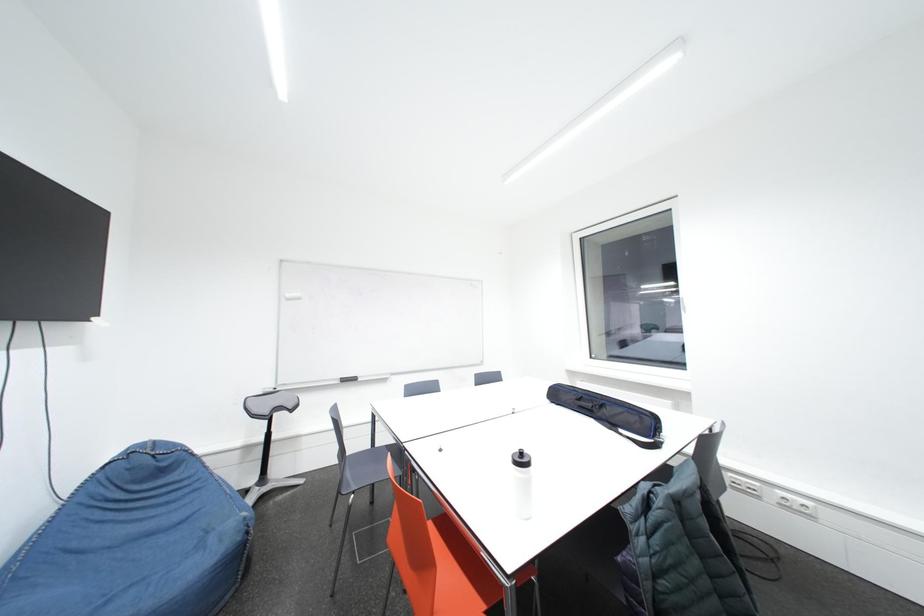
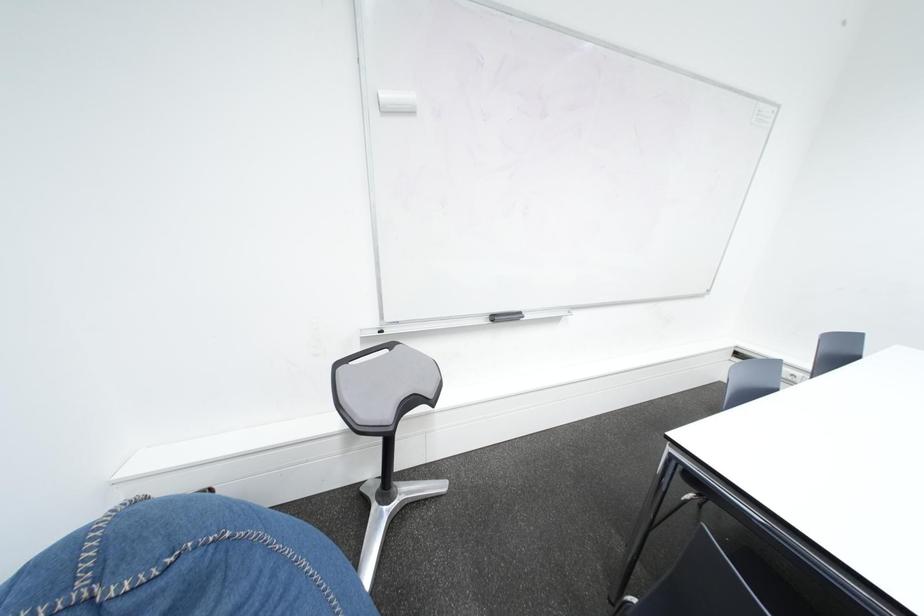
What movement of the cameraman would produce the second image?

The cameraman moved toward left, forward.